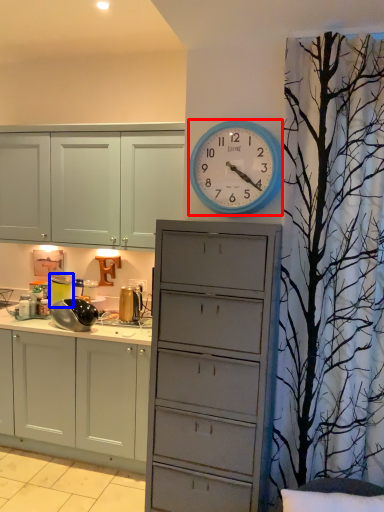
Question: Which object is closer to the camera taking this photo, wall clock (highlighted by a red box) or appliance (highlighted by a blue box)?

Choices:
 (A) wall clock
 (B) appliance

Answer: (A)